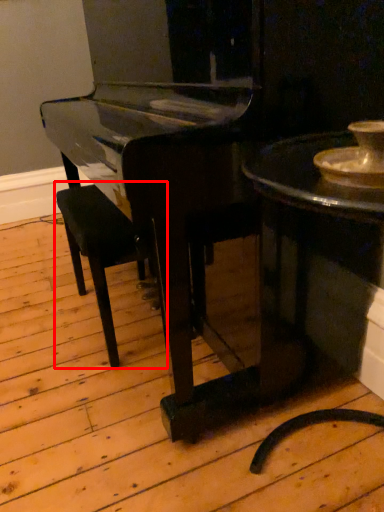
Question: Where is armchair (annotated by the red box) located in relation to table in the image?

Choices:
 (A) right
 (B) left

Answer: (B)